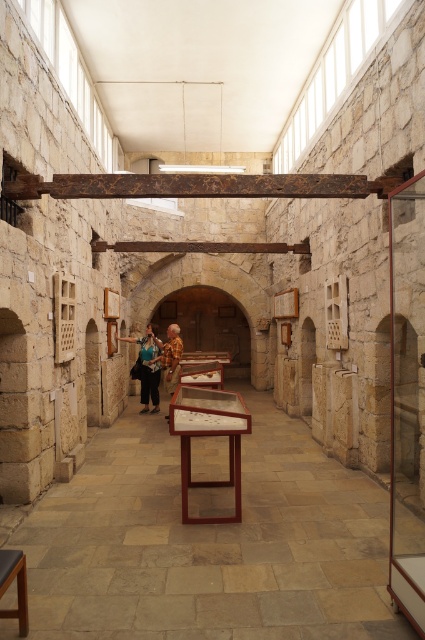
You are standing in the museum and want to reach a specific point marked as point 1. The point is located at coordinates [153,349]. Given that the distance from your current position to this point is 10.96 meters, can you estimate how far you need to walk to reach it?

The distance between you and point 1 is 10.96 meters, so you need to walk approximately 10.96 meters to reach it.

You are a tour guide leading a group through this historical museum. You need to move from the point at coordinates point at (x=62, y=582) to the exit located at the opposite corner of the room. The path between them is 3.99 meters long. If your group moves at an average speed of 0.5 meters per second, how many seconds will it take them to reach the exit?

The path between the point at (x=62, y=582) and the exit is 3.99 meters long. At a speed of 0.5 meters per second, it will take 3.99 divided by 0.5, which equals approximately 7.98 seconds. So, it will take about 8 seconds to reach the exit.